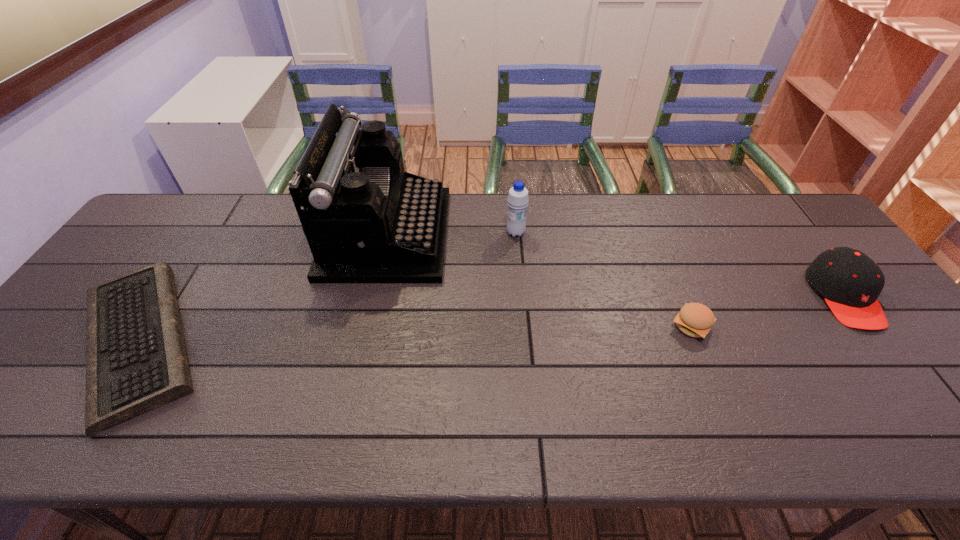
At what (x,y) coordinates should I click in order to perform the action: click on typewriter. Please return your answer as a coordinate pair (x, y). Image resolution: width=960 pixels, height=540 pixels. Looking at the image, I should click on (366, 220).

The image size is (960, 540). I want to click on the fourth object from right to left, so click(x=366, y=220).

Image resolution: width=960 pixels, height=540 pixels. What are the coordinates of `the third object from left to right` in the screenshot? It's located at (517, 200).

Locate an element on the screen. water bottle is located at coordinates (517, 200).

Find the location of `the rightmost object`. the rightmost object is located at coordinates (850, 282).

This screenshot has height=540, width=960. I want to click on the third shortest object, so click(x=850, y=282).

Identify the location of hamburger. Image resolution: width=960 pixels, height=540 pixels. (695, 320).

In order to click on the fourth object from left to right in this screenshot , I will do `click(695, 320)`.

Find the location of a particular element. vacant area located 0.230m on the typing side of the second object from left to right is located at coordinates 521,234.

Image resolution: width=960 pixels, height=540 pixels. Identify the location of free space located on the front of the water bottle. (521, 299).